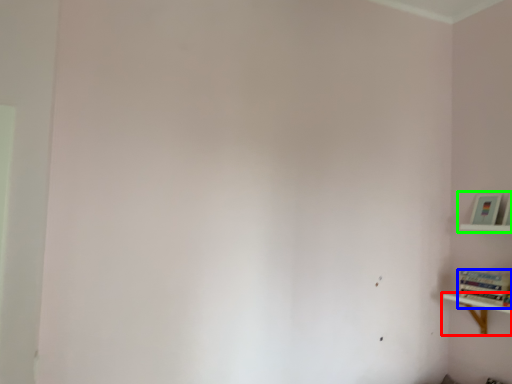
Question: Based on their relative distances, which object is farther from shelf (highlighted by a red box)? Choose from book (highlighted by a blue box) and shelf (highlighted by a green box).

Choices:
 (A) book
 (B) shelf

Answer: (B)